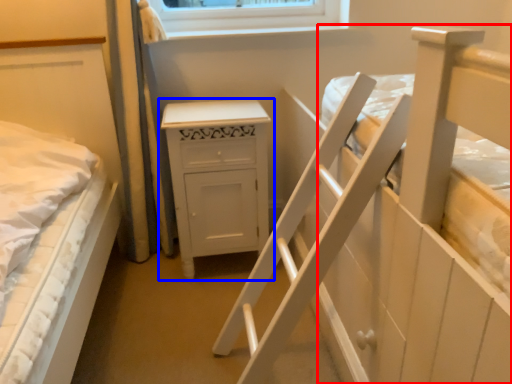
Question: Which point is closer to the camera, bed (highlighted by a red box) or chest of drawers (highlighted by a blue box)?

Choices:
 (A) bed
 (B) chest of drawers

Answer: (A)